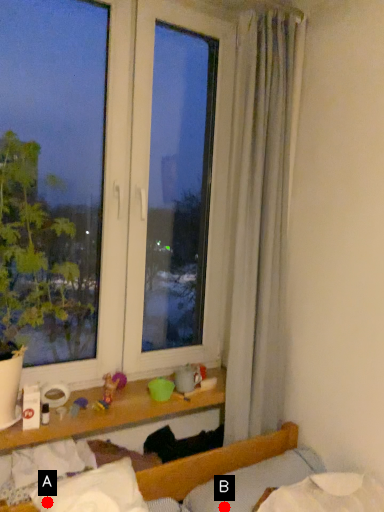
Question: Two points are circled on the image, labeled by A and B beside each circle. Which point appears closest to the camera in this image?

Choices:
 (A) A is closer
 (B) B is closer

Answer: (A)